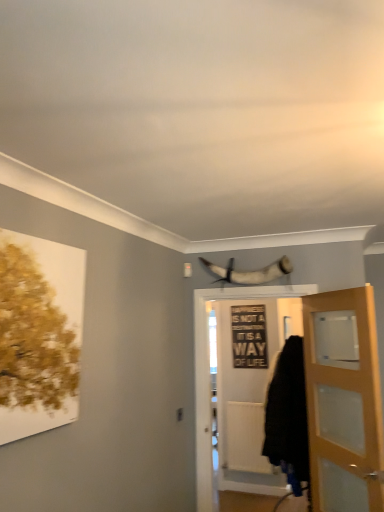
Question: Does shiny silver horn at upper center appear on the right side of light brown wooden door at right, the 1th door from the right?

Choices:
 (A) yes
 (B) no

Answer: (B)

Question: From a real-world perspective, is shiny silver horn at upper center beneath light brown wooden door at right, the 1th door from the right?

Choices:
 (A) no
 (B) yes

Answer: (A)

Question: Is shiny silver horn at upper center taller than light brown wooden door at right, which ranks as the 2th door in left-to-right order?

Choices:
 (A) yes
 (B) no

Answer: (B)

Question: Is shiny silver horn at upper center located outside light brown wooden door at right, the 1th door from the right?

Choices:
 (A) yes
 (B) no

Answer: (A)

Question: Could light brown wooden door at right, which ranks as the 2th door in left-to-right order, be considered to be inside shiny silver horn at upper center?

Choices:
 (A) yes
 (B) no

Answer: (B)

Question: In the image, is light brown wooden door at right, which ranks as the 2th door in left-to-right order, on the left side or the right side of white wooden door at center, positioned as the 2th door in right-to-left order?

Choices:
 (A) right
 (B) left

Answer: (A)

Question: Does point (375, 387) appear closer or farther from the camera than point (198, 478)?

Choices:
 (A) farther
 (B) closer

Answer: (B)

Question: Is light brown wooden door at right, the 1th door from the right, inside the boundaries of white wooden door at center, positioned as the 2th door in right-to-left order, or outside?

Choices:
 (A) outside
 (B) inside

Answer: (A)

Question: Considering the positions of light brown wooden door at right, which ranks as the 2th door in left-to-right order, and white wooden door at center, acting as the first door starting from the left, in the image, is light brown wooden door at right, which ranks as the 2th door in left-to-right order, taller or shorter than white wooden door at center, acting as the first door starting from the left,?

Choices:
 (A) tall
 (B) short

Answer: (B)

Question: Considering the positions of white wooden door at center, acting as the first door starting from the left, and light brown wooden door at right, which ranks as the 2th door in left-to-right order, in the image, is white wooden door at center, acting as the first door starting from the left, bigger or smaller than light brown wooden door at right, which ranks as the 2th door in left-to-right order,?

Choices:
 (A) big
 (B) small

Answer: (A)

Question: Based on their positions, is white wooden door at center, acting as the first door starting from the left, located to the left or right of light brown wooden door at right, the 1th door from the right?

Choices:
 (A) right
 (B) left

Answer: (B)

Question: From a real-world perspective, relative to light brown wooden door at right, the 1th door from the right, is white wooden door at center, positioned as the 2th door in right-to-left order, vertically above or below?

Choices:
 (A) below
 (B) above

Answer: (A)

Question: In terms of height, does white wooden door at center, acting as the first door starting from the left, look taller or shorter compared to light brown wooden door at right, which ranks as the 2th door in left-to-right order?

Choices:
 (A) short
 (B) tall

Answer: (B)

Question: Looking at their shapes, would you say white wooden door at center, positioned as the 2th door in right-to-left order, is wider or thinner than black fabric cloak at lower right?

Choices:
 (A) thin
 (B) wide

Answer: (A)

Question: From the image's perspective, is white wooden door at center, acting as the first door starting from the left, located above or below black fabric cloak at lower right?

Choices:
 (A) above
 (B) below

Answer: (A)